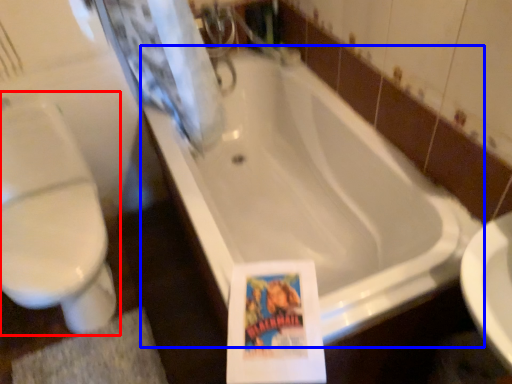
Question: Which object is closer to the camera taking this photo, toilet (highlighted by a red box) or bathtub (highlighted by a blue box)?

Choices:
 (A) toilet
 (B) bathtub

Answer: (B)